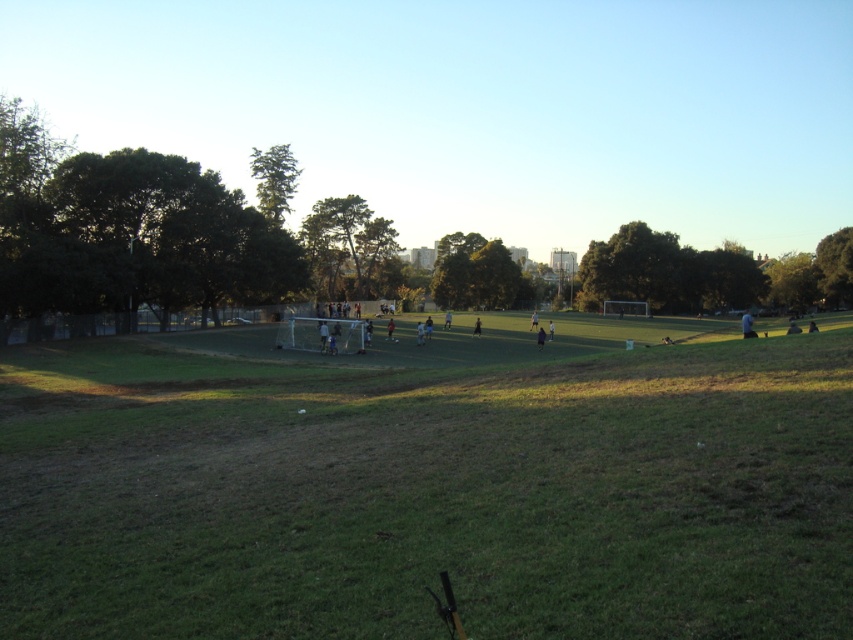
Who is lower down, green grassy field at center or dark blue jersey at center?

green grassy field at center

Can you confirm if green grassy field at center is positioned to the left of dark blue jersey at center?

In fact, green grassy field at center is to the right of dark blue jersey at center.

In order to click on green grassy field at center in this screenshot , I will do `click(428, 484)`.

Consider the image. Between green grassy field at center and black fabric person at center, which one appears on the right side from the viewer's perspective?

From the viewer's perspective, black fabric person at center appears more on the right side.

Is green grassy field at center positioned before black fabric person at center?

Yes, green grassy field at center is closer to the viewer.

Between point (698, 438) and point (476, 326), which one is positioned behind?

The point (476, 326) is more distant.

Image resolution: width=853 pixels, height=640 pixels. I want to click on green grassy field at center, so click(x=428, y=484).

Is point (750, 330) behind point (392, 320)?

No, (750, 330) is closer to viewer.

Is light blue shirt at center below dark blue jersey at center?

Incorrect, light blue shirt at center is not positioned below dark blue jersey at center.

What do you see at coordinates (747, 324) in the screenshot? I see `light blue shirt at center` at bounding box center [747, 324].

The height and width of the screenshot is (640, 853). Identify the location of light blue shirt at center. (747, 324).